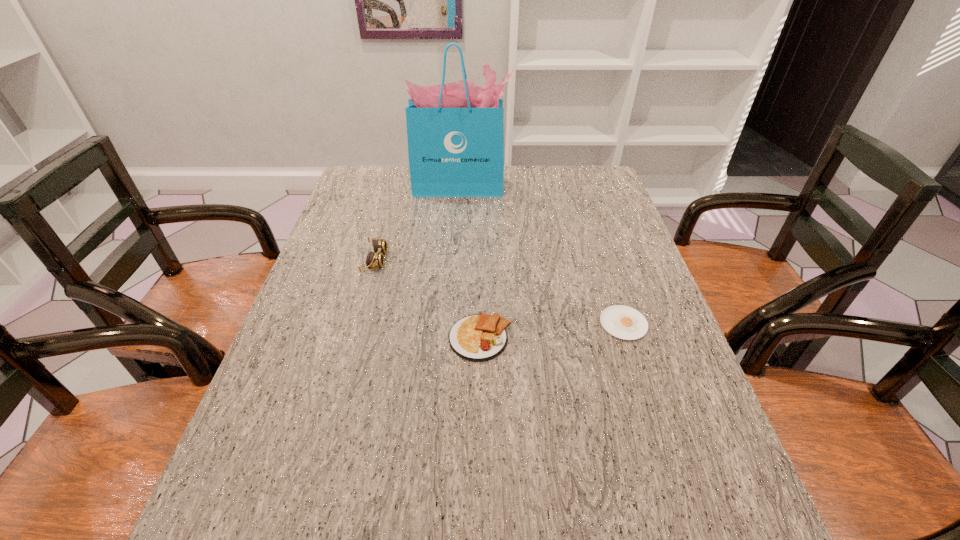
Select which object appears as the second closest to the goggles. Please provide its 2D coordinates. Your answer should be formatted as a tuple, i.e. [(x, y)], where the tuple contains the x and y coordinates of a point satisfying the conditions above.

[(455, 131)]

Select which object appears as the closest to the rightmost object. Please provide its 2D coordinates. Your answer should be formatted as a tuple, i.e. [(x, y)], where the tuple contains the x and y coordinates of a point satisfying the conditions above.

[(480, 337)]

Locate an element on the screen. This screenshot has width=960, height=540. free space that satisfies the following two spatial constraints: 1. through the lenses of the second farthest object; 2. on the back side of the shortest object is located at coordinates (358, 324).

Image resolution: width=960 pixels, height=540 pixels. I want to click on vacant space that satisfies the following two spatial constraints: 1. through the lenses of the shortest object; 2. on the left side of the goggles, so click(x=358, y=324).

I want to click on free space that satisfies the following two spatial constraints: 1. through the lenses of the rightmost object; 2. on the left side of the leftmost object, so click(x=358, y=324).

Locate an element on the screen. The height and width of the screenshot is (540, 960). free spot that satisfies the following two spatial constraints: 1. through the lenses of the second farthest object; 2. on the back side of the third tallest object is located at coordinates (354, 338).

At what (x,y) coordinates should I click in order to perform the action: click on free spot that satisfies the following two spatial constraints: 1. through the lenses of the goggles; 2. on the right side of the shortest object. Please return your answer as a coordinate pair (x, y). The height and width of the screenshot is (540, 960). Looking at the image, I should click on (358, 324).

This screenshot has height=540, width=960. I want to click on blank space that satisfies the following two spatial constraints: 1. on the back side of the egg yolk; 2. on the right side of the omelet, so pos(480,324).

Locate an element on the screen. This screenshot has width=960, height=540. free region that satisfies the following two spatial constraints: 1. through the lenses of the egg yolk; 2. on the left side of the second farthest object is located at coordinates (358, 324).

You are a GUI agent. You are given a task and a screenshot of the screen. Output one action in this format:
    pyautogui.click(x=<x>, y=<y>)
    Task: Click on the free location that satisfies the following two spatial constraints: 1. on the back side of the shortest object; 2. on the left side of the omelet
    Image resolution: width=960 pixels, height=540 pixels.
    Given the screenshot: What is the action you would take?
    pyautogui.click(x=480, y=324)